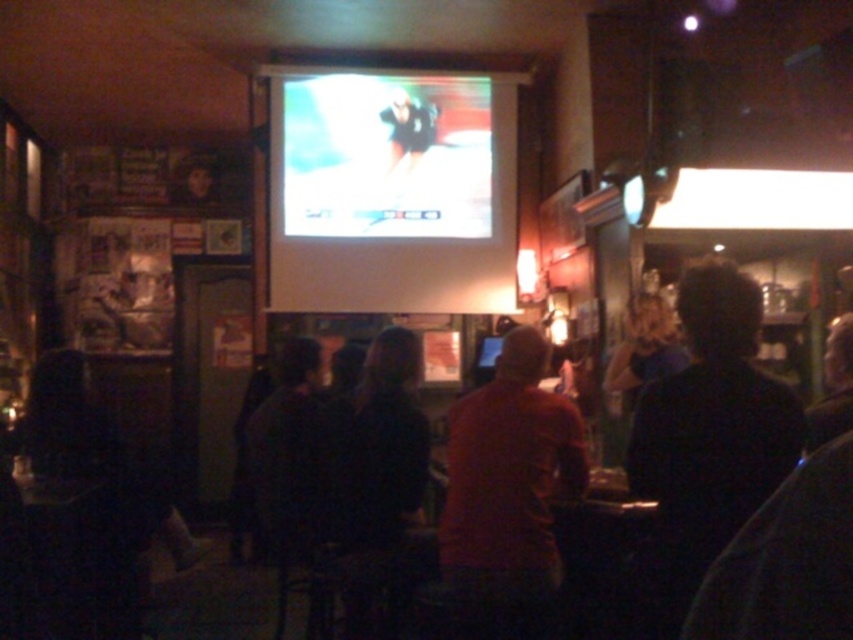
Between point (482, 99) and point (453, 429), which one is positioned behind?

Positioned behind is point (482, 99).

Is matte plastic screen at upper center taller than red matte shirt at center?

Yes.

The image size is (853, 640). What do you see at coordinates (386, 156) in the screenshot?
I see `matte plastic screen at upper center` at bounding box center [386, 156].

In order to click on matte plastic screen at upper center in this screenshot , I will do `click(386, 156)`.